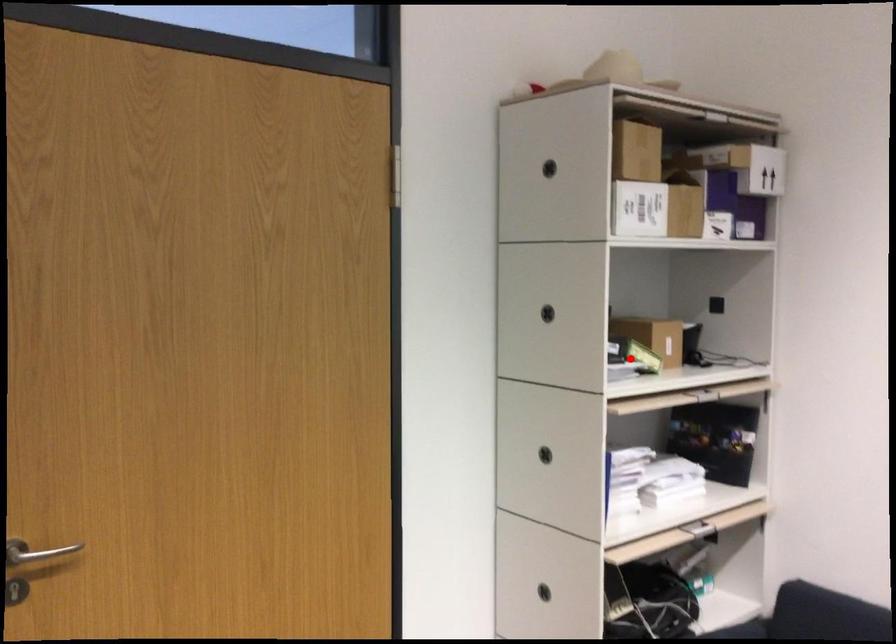
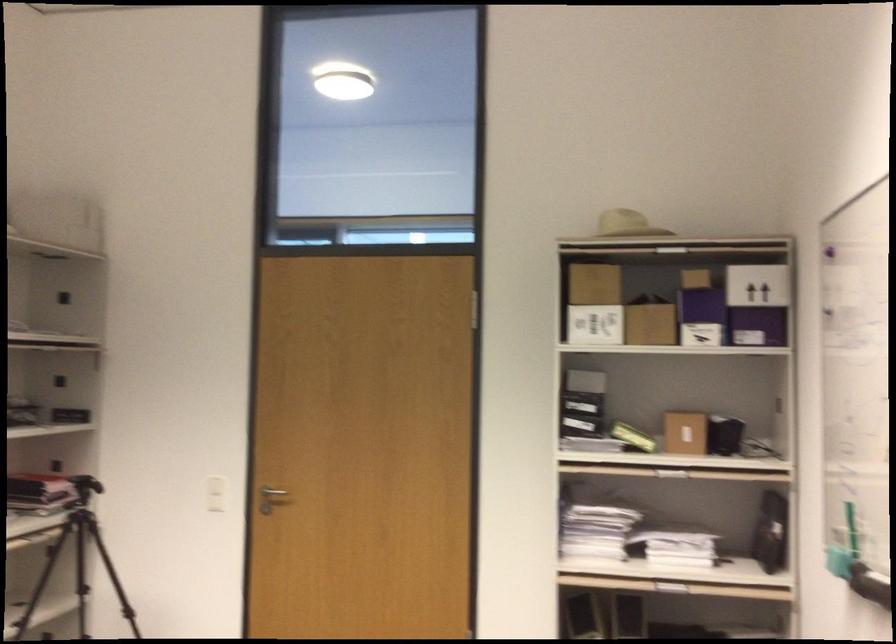
Question: I am providing you with two images of the same scene from different viewpoints. A red point is shown in image1. For the corresponding object point in image2, is it positioned nearer or farther from the camera?

Choices:
 (A) Nearer
 (B) Farther

Answer: (B)